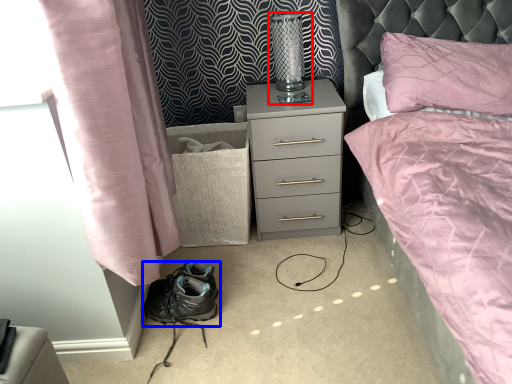
Question: Which object appears closest to the camera in this image, bedside lamp (highlighted by a red box) or footwear (highlighted by a blue box)?

Choices:
 (A) bedside lamp
 (B) footwear

Answer: (B)